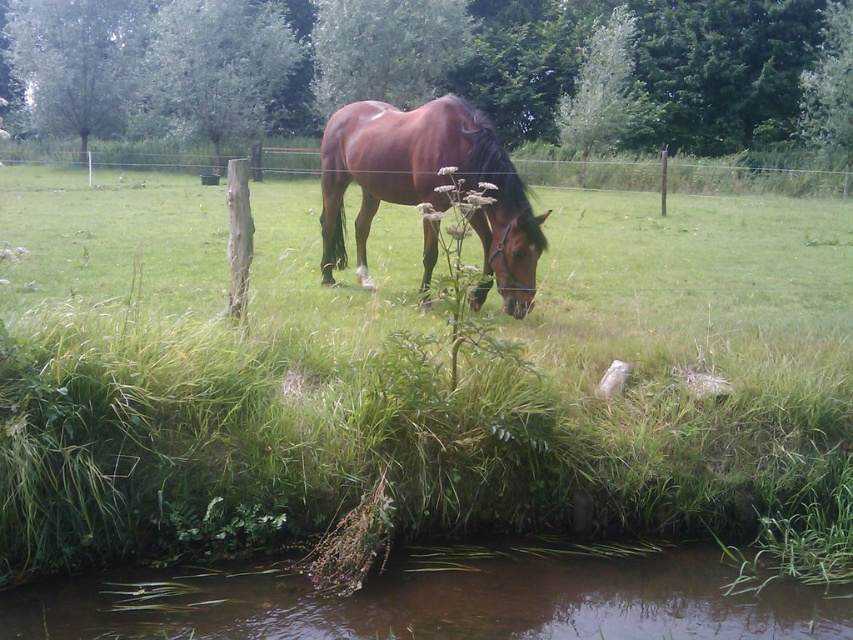
Question: Which of the following is the closest to the observer?

Choices:
 (A) (444, 208)
 (B) (289, 545)
 (C) (436, 627)

Answer: (C)

Question: Which point is farther from the camera taking this photo?

Choices:
 (A) pos(412,164)
 (B) pos(506,614)
 (C) pos(479,356)

Answer: (A)

Question: Estimate the real-world distances between objects in this image. Which object is farther from the shiny brown horse at center?

Choices:
 (A) green grassy at center
 (B) brown muddy water at lower center

Answer: (A)

Question: Considering the relative positions of brown muddy water at lower center and shiny brown horse at center in the image provided, where is brown muddy water at lower center located with respect to shiny brown horse at center?

Choices:
 (A) below
 (B) above

Answer: (A)

Question: From the image, what is the correct spatial relationship of brown muddy water at lower center in relation to shiny brown horse at center?

Choices:
 (A) left
 (B) right

Answer: (A)

Question: Does brown muddy water at lower center appear under shiny brown horse at center?

Choices:
 (A) no
 (B) yes

Answer: (B)